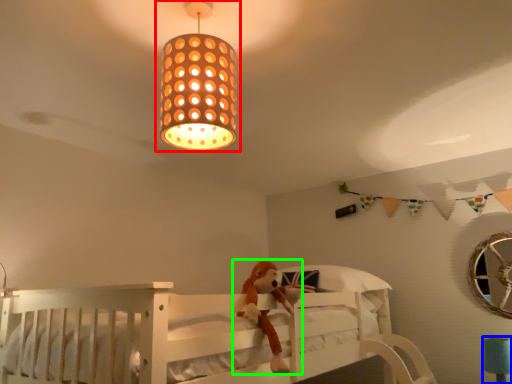
Question: Which is farther away from lamp (highlighted by a red box)? table lamp (highlighted by a blue box) or toy (highlighted by a green box)?

Choices:
 (A) table lamp
 (B) toy

Answer: (A)